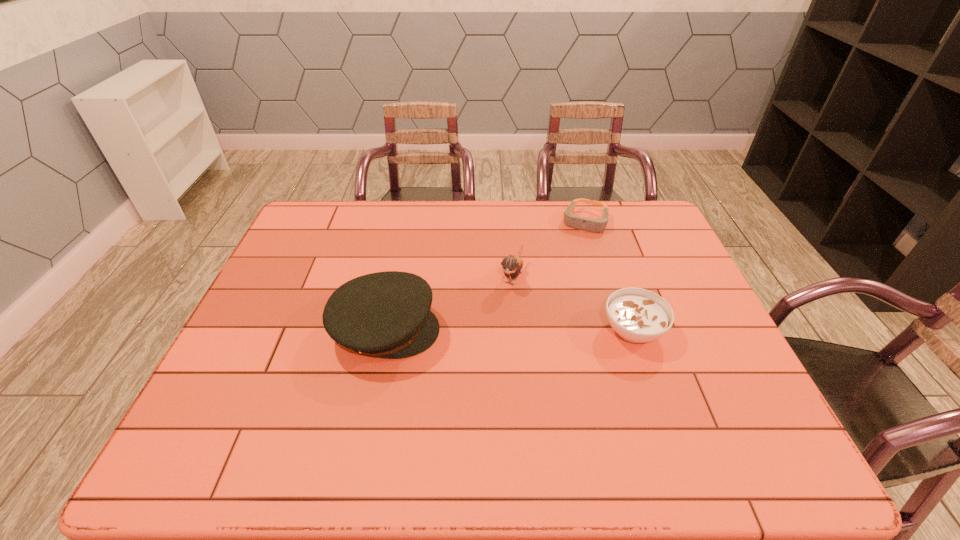
Find the location of a particular element. Image resolution: width=960 pixels, height=540 pixels. free space on the desktop that is between the leftmost object and the third tallest object and is positioned on the front-facing side of the second farthest object is located at coordinates (483, 330).

The image size is (960, 540). Find the location of `vacant spot on the desktop that is between the tallest object and the soup bowl and is positioned on the front and back of the goggles`. vacant spot on the desktop that is between the tallest object and the soup bowl and is positioned on the front and back of the goggles is located at coordinates (546, 330).